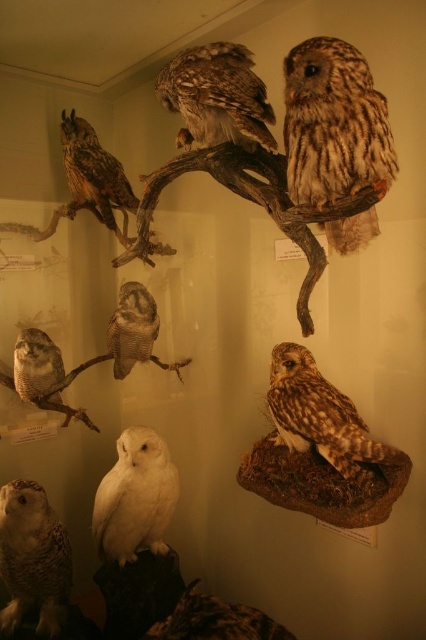
You are a museum guide explaining the owls in the exhibit. A visitor asks which owl is bigger between the white feathered owl at lower left and the brown speckled owl at center. What do you tell them?

The white feathered owl at lower left is larger in size compared to the brown speckled owl at center.